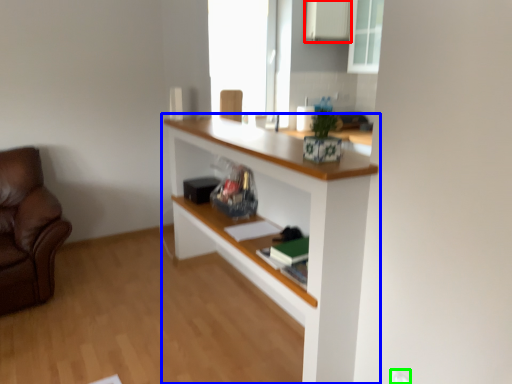
Question: Considering the real-world distances, which object is closest to cabinetry (highlighted by a red box)? shelf (highlighted by a blue box) or electric outlet (highlighted by a green box).

Choices:
 (A) shelf
 (B) electric outlet

Answer: (A)